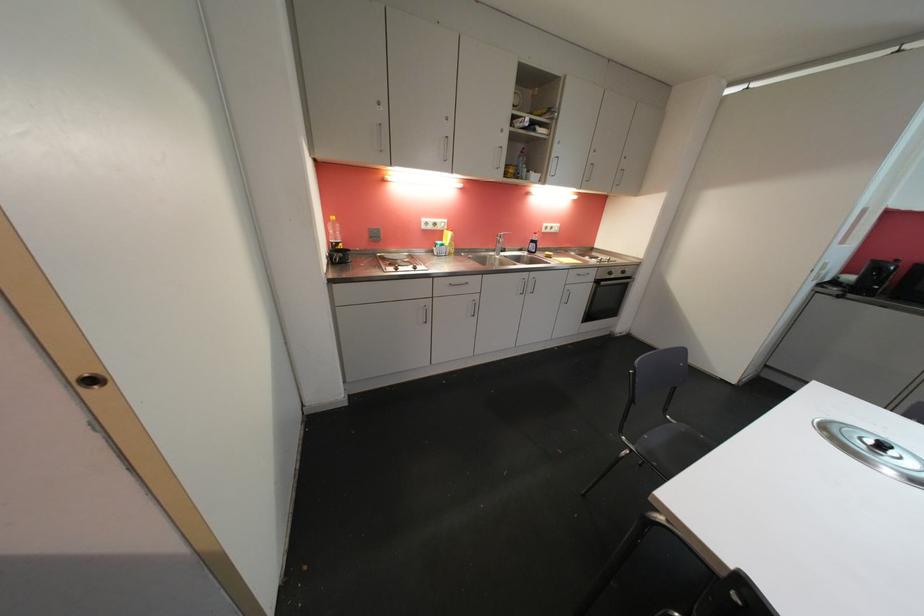
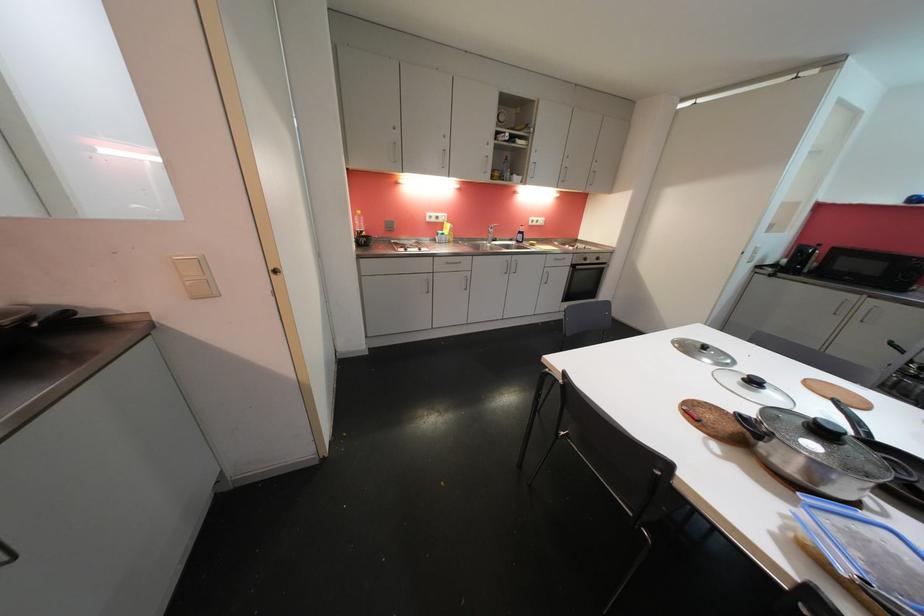
Find the pixel in the second image that matches (x=558, y=156) in the first image.

(537, 163)